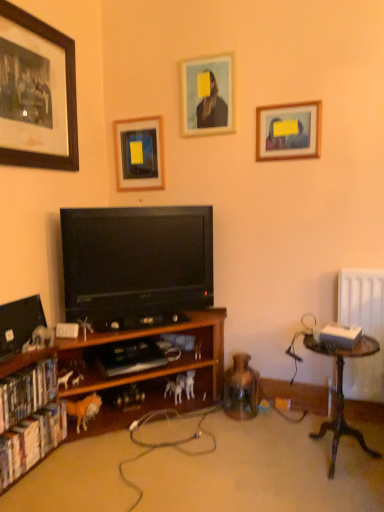
You are a GUI agent. You are given a task and a screenshot of the screen. Output one action in this format:
    pyautogui.click(x=<x>, y=<y>)
    Task: Click on the free space to the left of wooden table at right
    The image size is (384, 512).
    Given the screenshot: What is the action you would take?
    pyautogui.click(x=269, y=460)